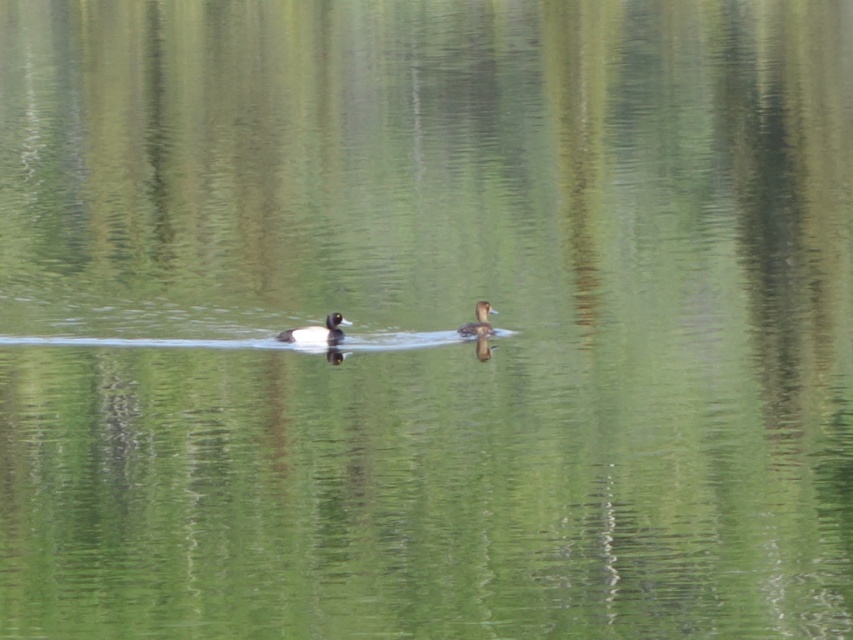
Question: Which object is closer to the camera taking this photo?

Choices:
 (A) brown fuzzy duck at center
 (B) brown matte duck at center

Answer: (B)

Question: Is brown matte duck at center in front of brown fuzzy duck at center?

Choices:
 (A) no
 (B) yes

Answer: (B)

Question: Which point is farther from the camera taking this photo?

Choices:
 (A) (485, 320)
 (B) (329, 317)

Answer: (A)

Question: Observing the image, what is the correct spatial positioning of brown matte duck at center in reference to brown fuzzy duck at center?

Choices:
 (A) left
 (B) right

Answer: (A)

Question: Does brown matte duck at center have a smaller size compared to brown fuzzy duck at center?

Choices:
 (A) yes
 (B) no

Answer: (B)